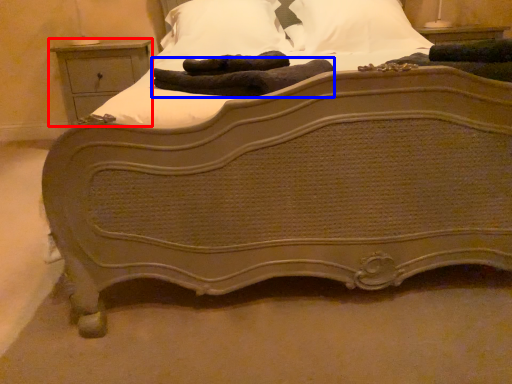
Question: Which object appears farthest to the camera in this image, nightstand (highlighted by a red box) or material (highlighted by a blue box)?

Choices:
 (A) nightstand
 (B) material

Answer: (A)